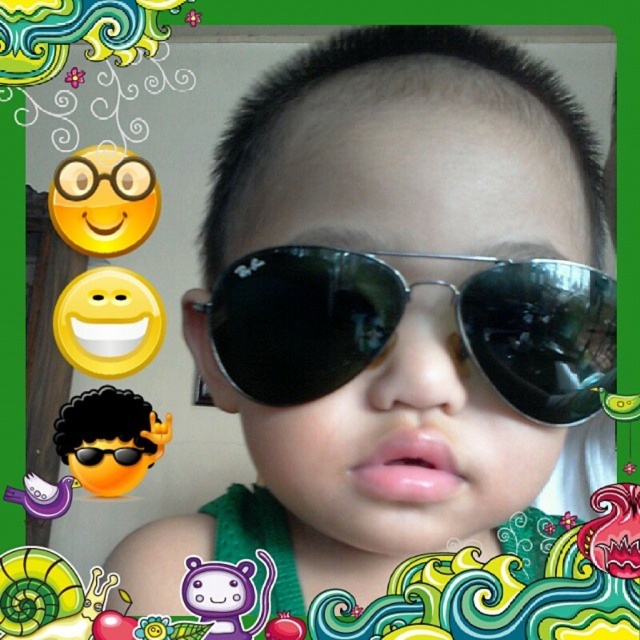
You are designing a poster and need to place a logo exactly at the center of the matte black sunglasses at center. What coordinates should you use?

You should place the logo at coordinates point (x=404, y=440) since that is where the matte black sunglasses at center are located.

You are looking at a photo of a child wearing sunglasses. The photo has two pairs of sunglasses labeled as matte black sunglasses at center and black reflective sunglasses at center. Which one is positioned to the left?

The matte black sunglasses at center is positioned to the left of the black reflective sunglasses at center.

You are designing a poster and want to place both the matte black sunglasses at center and the black reflective sunglasses at center on it. Which pair of sunglasses should you choose if you need the larger size for better visibility?

The matte black sunglasses at center has a larger size compared to the black reflective sunglasses at center, so you should choose the matte black sunglasses at center for better visibility.